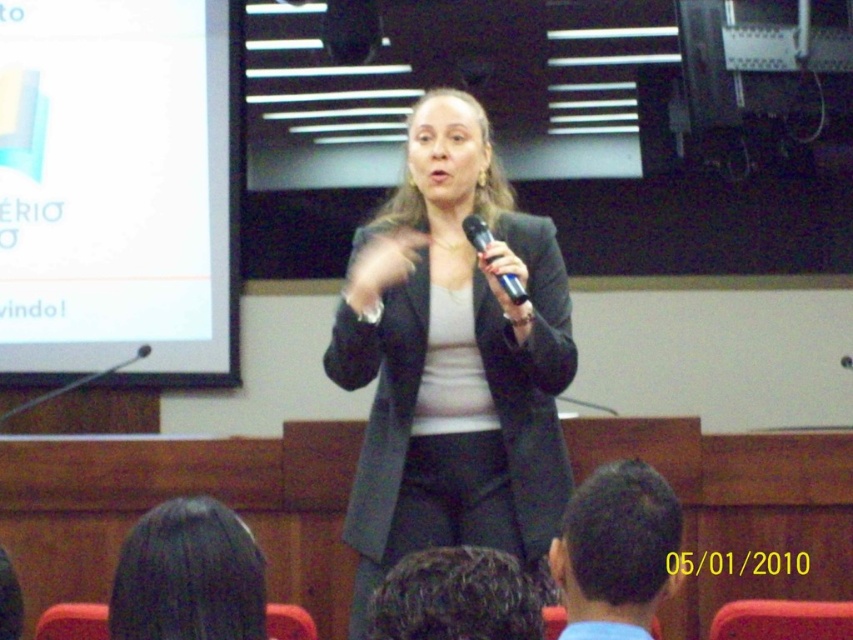
You are an event organizer setting up a stage for a presentation. You need to place a blue fabric head at lower center. Where exactly should you position it?

The blue fabric head at lower center should be positioned at point (616, 548) as specified in the description.

You are a stagehand preparing to place a 36 inch wide banner between the matte black blazer at center and the dark hair at lower left. Can the banner fit between them without overlapping either?

The distance between the matte black blazer at center and the dark hair at lower left is 35.83 inches. Since the banner is 36 inches wide, it would be slightly too wide to fit between them without overlapping.

You are an attendee at the event and want to describe the speaker to a friend who hasn t arrived yet. Which object is positioned higher on the speaker s body the matte black blazer at center or the dark hair at lower left?

The matte black blazer at center is located above the dark hair at lower left, so the matte black blazer at center is positioned higher on the speaker s body.